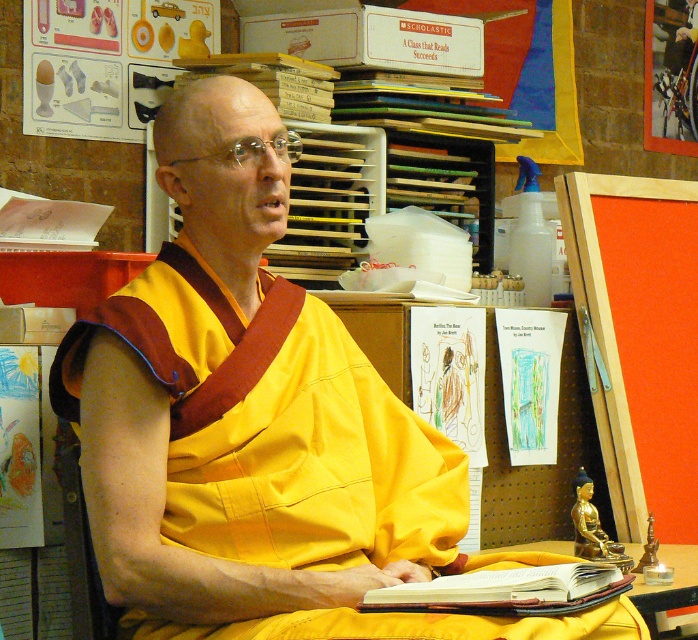
Which of these two, leather-bound book at center or wooden table at lower center, stands shorter?

leather-bound book at center

Locate an element on the screen. leather-bound book at center is located at coordinates (505, 592).